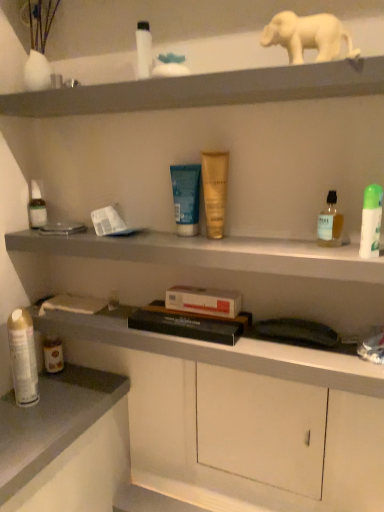
Image resolution: width=384 pixels, height=512 pixels. In order to click on vacant area that lies to the right of blue matte tube at center, the third toiletry from the back in this screenshot , I will do `click(259, 240)`.